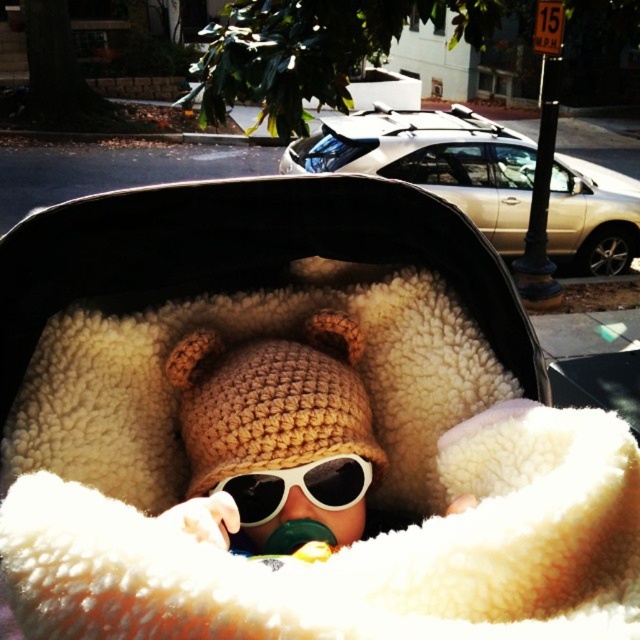
You are a parent trying to place a small stuffed animal on top of the fuzzy beige baby carriage at center so it can be seen by the baby wearing the white plastic goggles at center. Will the stuffed animal be visible to the baby?

The fuzzy beige baby carriage at center is much taller than the white plastic goggles at center, so the stuffed animal placed on top will be higher than the baby wearing the white plastic goggles at center. Therefore, the baby might not be able to see the stuffed animal clearly unless they tilt their head back significantly.

You are a parent holding a baby toy that is 20 centimeters long. You want to place it in front of the baby so that it is exactly at point (339, 520). Considering the distance from you to that point is 59.06 centimeters, can you safely place the toy without it being too close or too far from the baby?

The distance from you to point (339, 520) is 59.06 centimeters. Since the toy is 20 centimeters long, placing it at that point would ensure it is within a safe and comfortable distance from the baby, as it is neither too close nor too far.